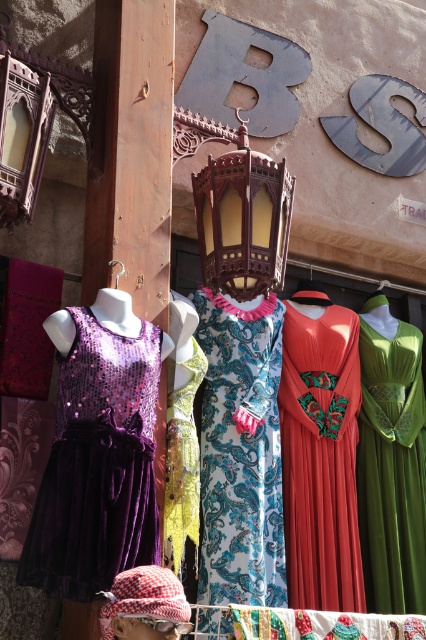
Between point (236, 353) and point (411, 412), which one is positioned behind?

The point (411, 412) is more distant.

Locate an element on the screen. blue paisley fabric dress at center is located at coordinates (241, 451).

Who is lower down, green velvet dress at center or yellow sequined dress at center?

green velvet dress at center

Locate an element on the screen. The image size is (426, 640). green velvet dress at center is located at coordinates [391, 468].

Is shiny purple velvet dress at left positioned at the back of shiny red dress at center?

No, shiny purple velvet dress at left is in front of shiny red dress at center.

Image resolution: width=426 pixels, height=640 pixels. What do you see at coordinates (97, 465) in the screenshot? I see `shiny purple velvet dress at left` at bounding box center [97, 465].

Which is behind, point (101, 502) or point (324, 348)?

Positioned behind is point (324, 348).

Identify the location of shiny purple velvet dress at left. (97, 465).